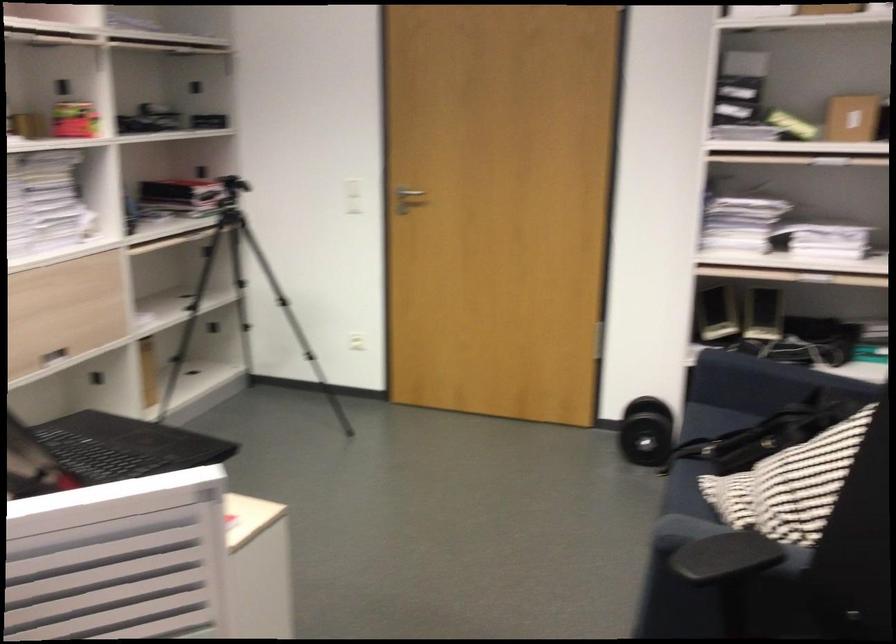
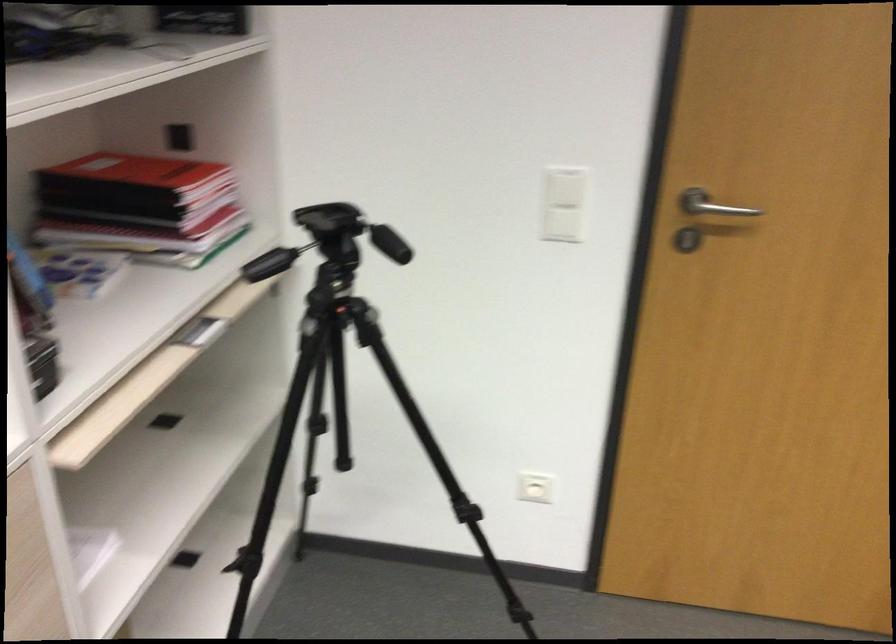
Where in the second image is the point corresponding to (359,184) from the first image?

(565, 187)